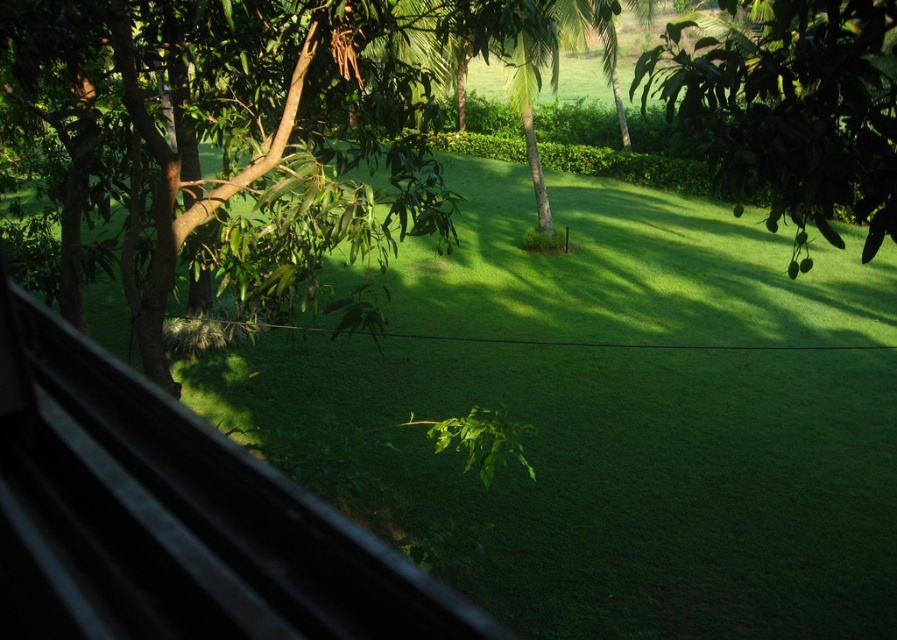
You are standing inside a building looking through a window and see the green leafy tree at upper left and the green leafy tree at upper right outside. Which tree appears wider in the window view?

The green leafy tree at upper left appears wider than the green leafy tree at upper right because its width surpasses the other.

You are standing inside a building looking through a window. You notice two trees outside. The first is the green leafy tree at upper left, and the second is the green leafy tree at upper right. Which tree takes up more space in the window view?

The green leafy tree at upper right takes up more space in the window view than the green leafy tree at upper left because it occupies more space according to the description.